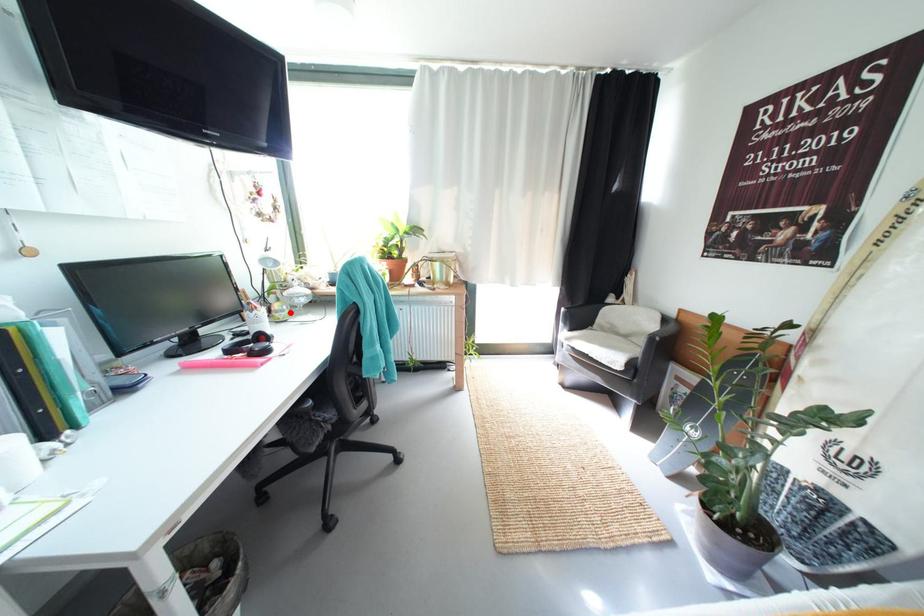
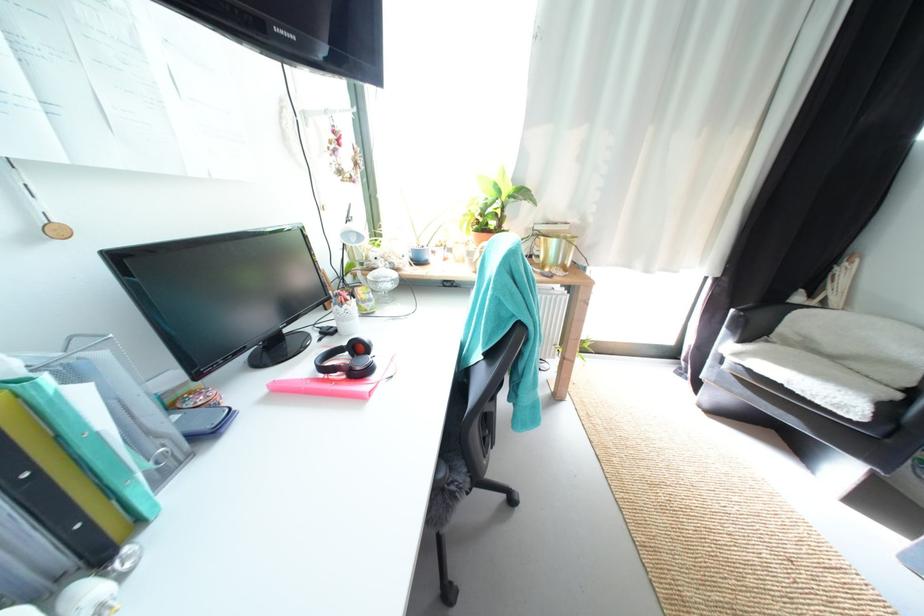
Locate, in the second image, the point that corresponds to the highlighted location in the first image.

(378, 302)